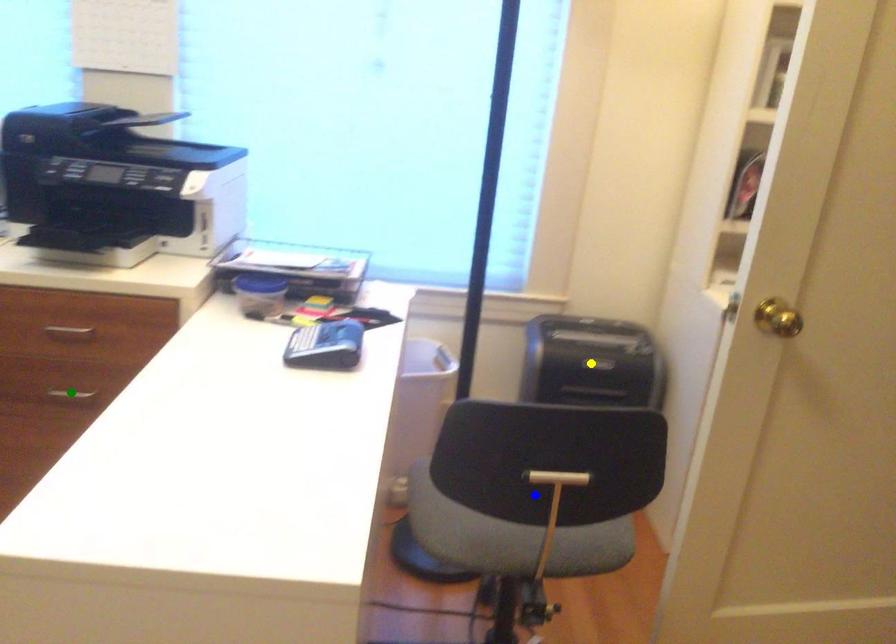
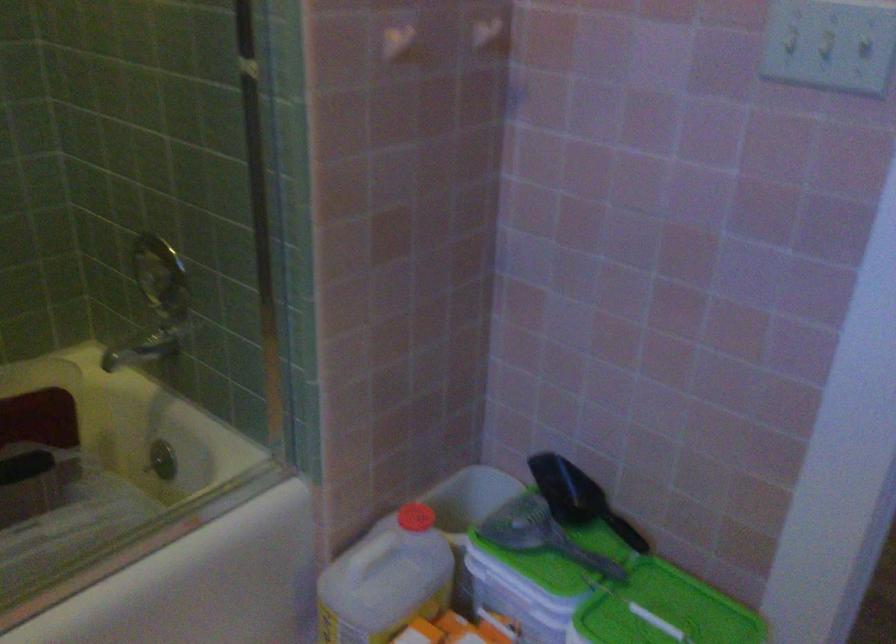
I am providing you with two images of the same scene from different viewpoints. Three points are marked in image1. Which point corresponds to a part or object that is occluded in image2?In image1, three points are marked. Which of them correspond to a part or object that is occluded in image2?Among the three points shown in image1, which one corresponds to a part or object that is no longer visible due to occlusion in image2?

Invisible in image2: blue point, yellow point, green point.